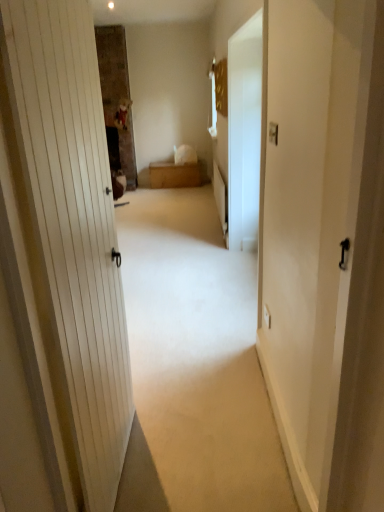
Question: Considering the relative positions of wooden chest at center and white matte door at center in the image provided, is wooden chest at center to the left of white matte door at center from the viewer's perspective?

Choices:
 (A) no
 (B) yes

Answer: (B)

Question: From the image's perspective, is wooden chest at center below white matte door at center?

Choices:
 (A) yes
 (B) no

Answer: (B)

Question: Is wooden chest at center shorter than white matte door at center?

Choices:
 (A) yes
 (B) no

Answer: (B)

Question: Can you confirm if wooden chest at center is positioned to the right of white matte door at center?

Choices:
 (A) yes
 (B) no

Answer: (B)

Question: Is wooden chest at center wider than white matte door at center?

Choices:
 (A) no
 (B) yes

Answer: (A)

Question: Is wooden chest at center outside of white matte door at center?

Choices:
 (A) yes
 (B) no

Answer: (A)

Question: Would you say white matte door at center is outside wooden chest at center?

Choices:
 (A) no
 (B) yes

Answer: (B)

Question: Is white matte door at center further to the viewer compared to wooden chest at center?

Choices:
 (A) no
 (B) yes

Answer: (A)

Question: Is white matte door at center turned away from wooden chest at center?

Choices:
 (A) no
 (B) yes

Answer: (A)

Question: Considering the relative positions of white matte door at center and wooden chest at center in the image provided, is white matte door at center to the left of wooden chest at center from the viewer's perspective?

Choices:
 (A) yes
 (B) no

Answer: (B)

Question: Is white matte door at center in contact with wooden chest at center?

Choices:
 (A) no
 (B) yes

Answer: (A)

Question: Does white matte door at center come in front of wooden chest at center?

Choices:
 (A) yes
 (B) no

Answer: (A)

Question: Does white glossy screen door at center have a greater width compared to white matte door at center?

Choices:
 (A) yes
 (B) no

Answer: (B)